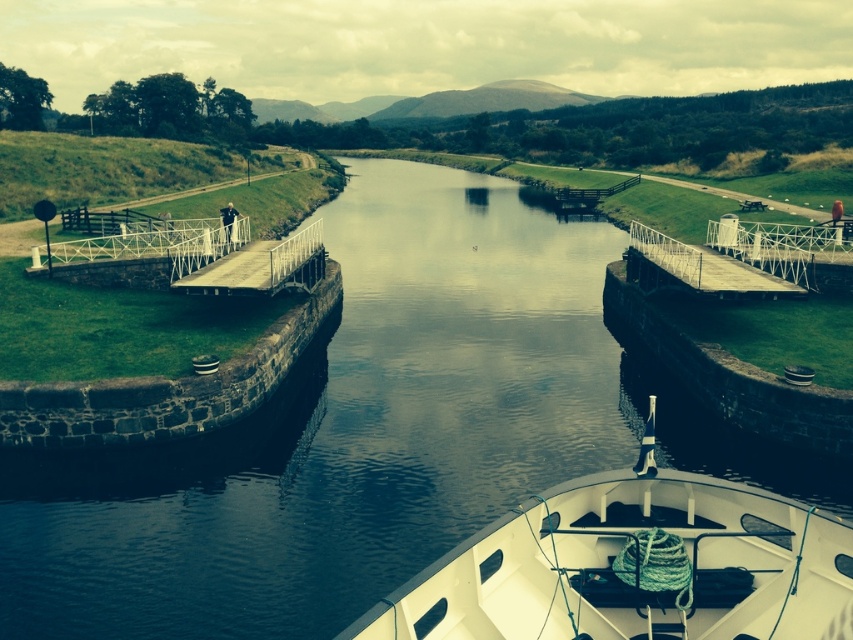
You are a boat captain trying to navigate a narrow boat through the lock gates. Your boat is 2 meters wide. You see the white metal dock at center and the metallic gray dock at center. Can your boat pass between them?

The white metal dock at center is above the metallic gray dock at center, so the vertical distance between them is sufficient for your boat to pass through. However, the horizontal distance between the docks isn not specified, so it is uncertain whether the boat can fit horizontally.

You are a tour boat captain planning to dock your boat at the white metal dock at center. Your boat is 15 meters long. If you approach the dock from the direction of the viewer, will your boat fit entirely within the visible canal area before reaching the lock gates on either side?

The white metal dock at center is 18.38 meters away from the viewer. Since your boat is 15 meters long, it will fit entirely within the visible canal area before reaching the lock gates on either side as there is sufficient space between the viewer and the dock.

You are navigating a small boat through the canal in the scene. You see a point marked at coordinates [634,564]. What object is located at that point?

The point at coordinates [634,564] indicates the white matte boat at center.